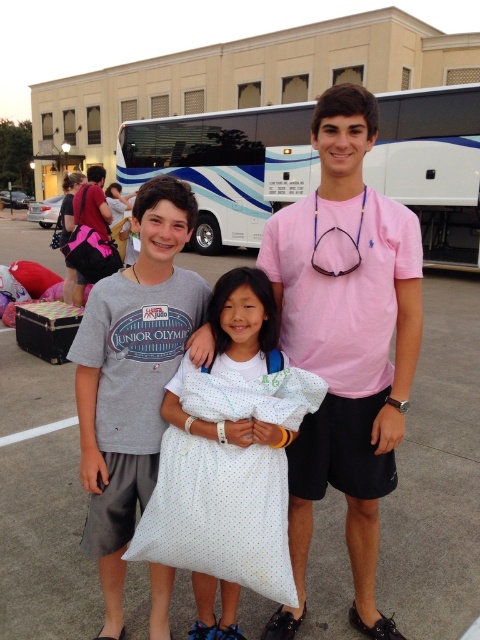
Question: Can you confirm if pink cotton t-shirt at center is wider than gray cotton t-shirt at center?

Choices:
 (A) no
 (B) yes

Answer: (B)

Question: Is gray cotton t-shirt at center positioned at the back of white dotted fabric bag at center?

Choices:
 (A) no
 (B) yes

Answer: (B)

Question: Which point is farther to the camera?

Choices:
 (A) white dotted fabric bag at center
 (B) gray cotton t-shirt at center
 (C) pink cotton t-shirt at center

Answer: (B)

Question: Which object appears farthest from the camera in this image?

Choices:
 (A) white glossy bus at center
 (B) matte gray t-shirt at center

Answer: (A)

Question: Is white glossy bus at center positioned at the back of white dotted fabric bag at center?

Choices:
 (A) yes
 (B) no

Answer: (A)

Question: Which object appears closest to the camera in this image?

Choices:
 (A) matte gray t-shirt at center
 (B) white dotted fabric bag at center

Answer: (B)